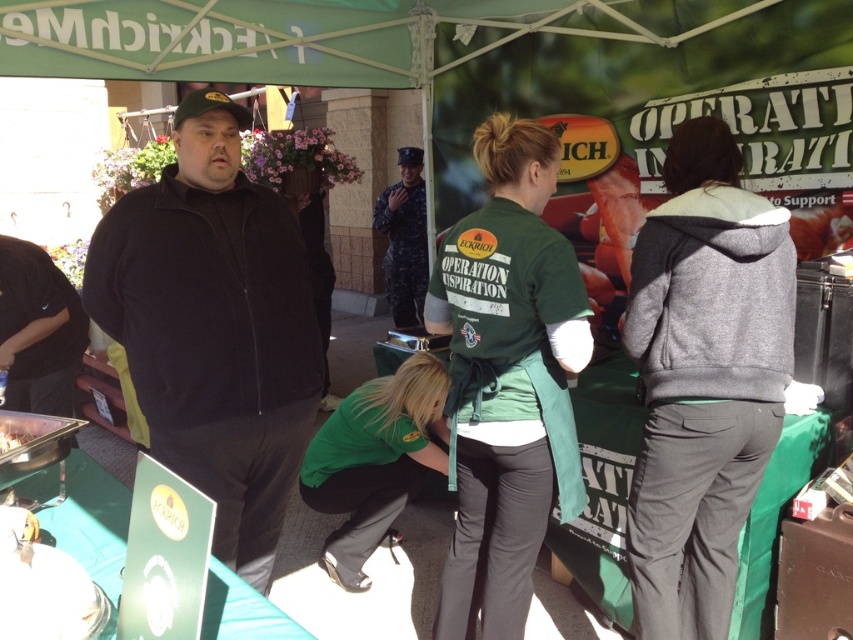
In the scene shown: You are a photographer at the event and want to capture both the gray fleece hoodie at right and the camouflage fabric uniform at center in a single frame. Which object should you focus on first to ensure both are in the frame?

The gray fleece hoodie at right is taller than the camouflage fabric uniform at center, so you should focus on the gray fleece hoodie at right first to ensure both are in the frame.

You are organizing a photo shoot and need to know which piece of clothing is wider between the black fleece jacket at center and the camouflage fabric uniform at center. Can you determine this based on the scene?

The black fleece jacket at center is wider than the camouflage fabric uniform at center according to the description.

You are a photographer positioned at the entrance of the tent. You want to capture a photo that includes both the black fleece jacket at center and the camouflage fabric uniform at center. Which object should you focus on first to ensure both are in frame?

The black fleece jacket at center is below the camouflage fabric uniform at center, so you should focus on the camouflage fabric uniform at center first to ensure both are in frame.